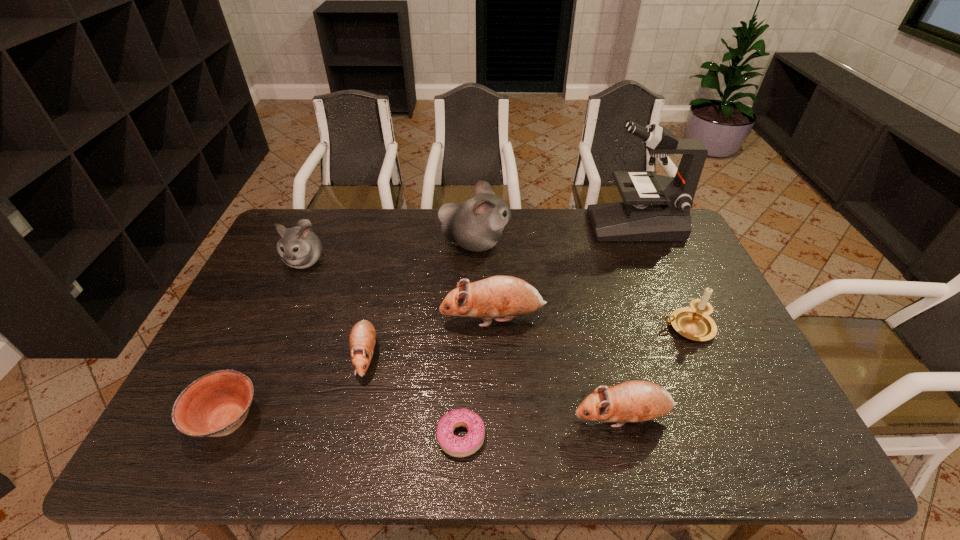
Where is `the leftmost brown hamster`? The width and height of the screenshot is (960, 540). the leftmost brown hamster is located at coordinates (362, 339).

Identify the location of bowl. This screenshot has height=540, width=960. (215, 405).

Where is `pink doughnut`? This screenshot has height=540, width=960. pink doughnut is located at coordinates (455, 446).

I want to click on the shortest object, so click(455, 446).

Where is `free point located through the eyepieces of the tallest object`? free point located through the eyepieces of the tallest object is located at coordinates (533, 225).

At what (x,y) coordinates should I click in order to perform the action: click on vacant space situated through the eyepieces of the tallest object. Please return your answer as a coordinate pair (x, y). This screenshot has width=960, height=540. Looking at the image, I should click on (539, 225).

Where is `free region located 0.190m through the eyepieces of the tallest object`? free region located 0.190m through the eyepieces of the tallest object is located at coordinates (539, 225).

This screenshot has height=540, width=960. Find the location of `vacant region located on the face of the eighth shortest object`. vacant region located on the face of the eighth shortest object is located at coordinates (612, 243).

Where is `free region located 0.300m on the face of the left white hamster`? free region located 0.300m on the face of the left white hamster is located at coordinates (263, 357).

The image size is (960, 540). In order to click on vacant space positioned at the face of the second brown hamster from right to left in this screenshot , I will do `click(347, 319)`.